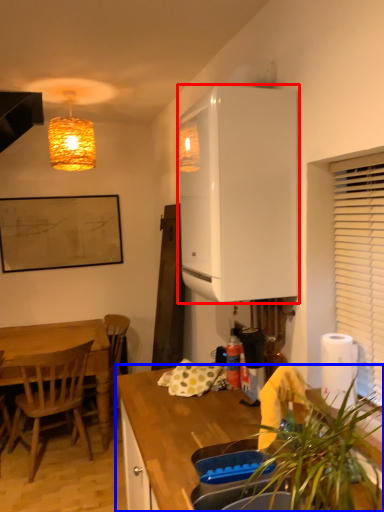
Question: Which object appears farthest to the camera in this image, cabinetry (highlighted by a red box) or countertop (highlighted by a blue box)?

Choices:
 (A) cabinetry
 (B) countertop

Answer: (A)